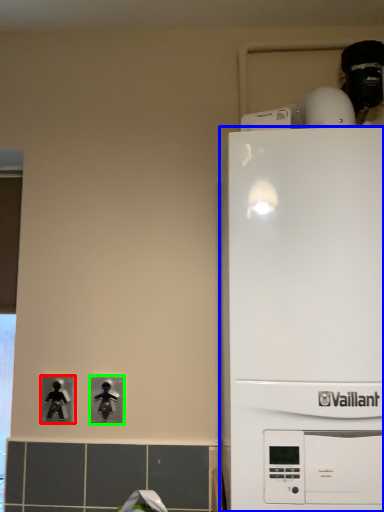
Question: Estimate the real-world distances between objects in this image. Which object is farther from light switch (highlighted by a red box), home appliance (highlighted by a blue box) or light switch (highlighted by a green box)?

Choices:
 (A) home appliance
 (B) light switch

Answer: (A)